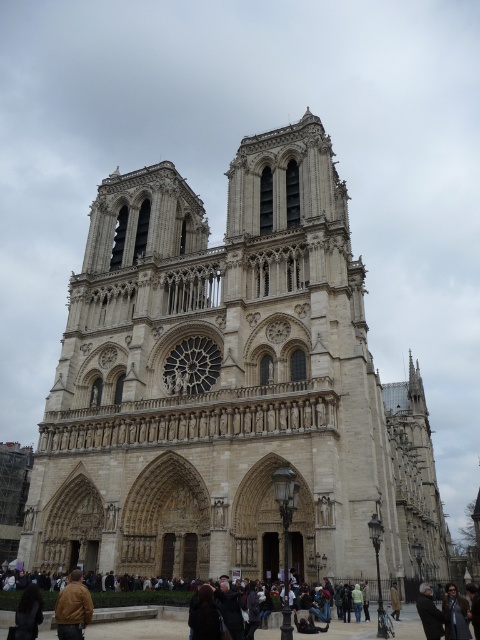
Is brown leather jacket at lower left above dark gray coat at lower right?

Yes.

Can you confirm if brown leather jacket at lower left is wider than dark gray coat at lower right?

Incorrect, brown leather jacket at lower left's width does not surpass dark gray coat at lower right's.

Describe the element at coordinates (72, 609) in the screenshot. The width and height of the screenshot is (480, 640). I see `brown leather jacket at lower left` at that location.

Identify the location of brown leather jacket at lower left. (72, 609).

Is white stone church at center to the right of brown leather jacket at lower left from the viewer's perspective?

Yes, white stone church at center is to the right of brown leather jacket at lower left.

Can you confirm if white stone church at center is bigger than brown leather jacket at lower left?

Yes, white stone church at center is bigger than brown leather jacket at lower left.

Locate an element on the screen. white stone church at center is located at coordinates (228, 387).

Where is `white stone church at center`? The image size is (480, 640). white stone church at center is located at coordinates (228, 387).

Is white stone church at center below brown wool coat at lower center?

No.

Identify the location of white stone church at center. The width and height of the screenshot is (480, 640). (228, 387).

Does point (38, 564) come farther from viewer compared to point (392, 592)?

Yes.

Find the location of a particular element. This screenshot has width=480, height=640. white stone church at center is located at coordinates (228, 387).